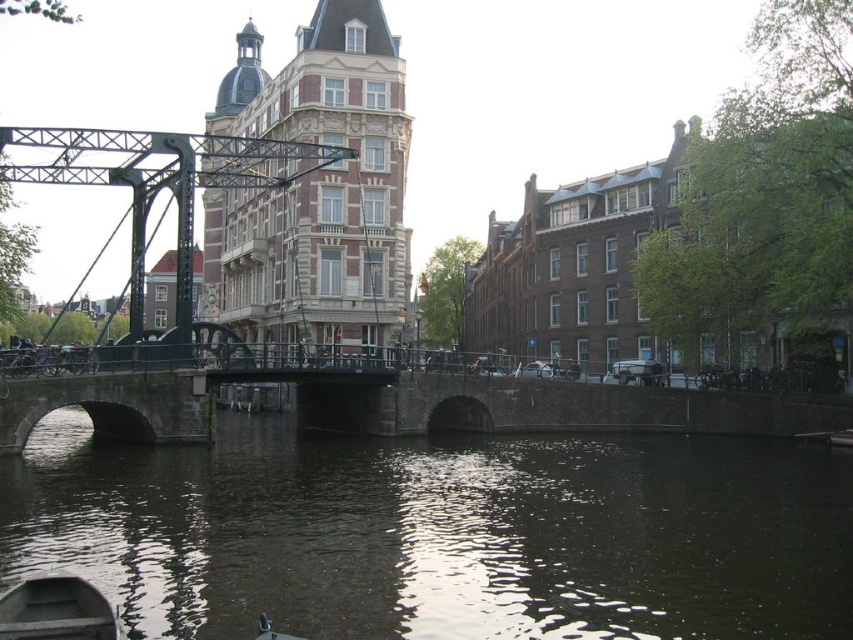
Which of these two, dark green water at center or wooden boat at lower left, stands shorter?

wooden boat at lower left

The height and width of the screenshot is (640, 853). I want to click on dark green water at center, so click(x=439, y=532).

Find the location of a particular element. dark green water at center is located at coordinates (439, 532).

Is matte black bridge at center shorter than wooden boat at lower left?

No, matte black bridge at center is not shorter than wooden boat at lower left.

What do you see at coordinates (143, 269) in the screenshot? This screenshot has height=640, width=853. I see `matte black bridge at center` at bounding box center [143, 269].

Is point (4, 404) farther from viewer compared to point (10, 628)?

Yes, it is.

Find the location of a particular element. matte black bridge at center is located at coordinates (143, 269).

Is dark green water at center wider than matte black bridge at center?

Yes.

What are the coordinates of `dark green water at center` in the screenshot? It's located at (439, 532).